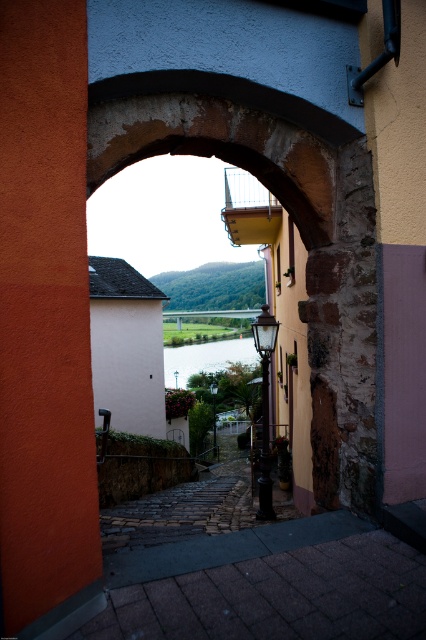
Looking at this image, you are standing in a room with an arched doorway leading to a street. You see a clear water at center and a polished brass lamp post at center. Which object is closer to the entrance of the arched doorway?

The clear water at center is positioned under the polished brass lamp post at center, so the polished brass lamp post at center is closer to the entrance of the arched doorway.

Looking at this image, you are a photographer planning to capture the view through the arched doorway. You notice the clear water at center and the polished brass lamp post at center. Which object would occupy more space in your photo, and why?

The clear water at center would occupy more space in your photo because it is larger in size than the polished brass lamp post at center.